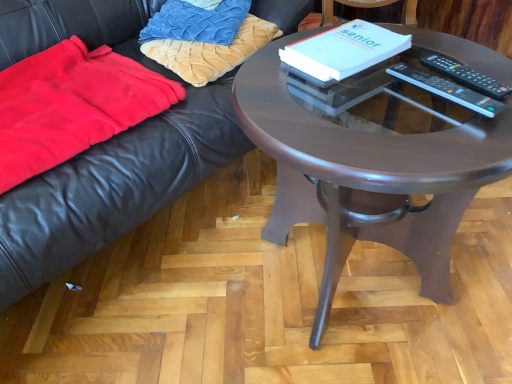
In order to click on blank space to the left of white paper at center in this screenshot , I will do `click(262, 72)`.